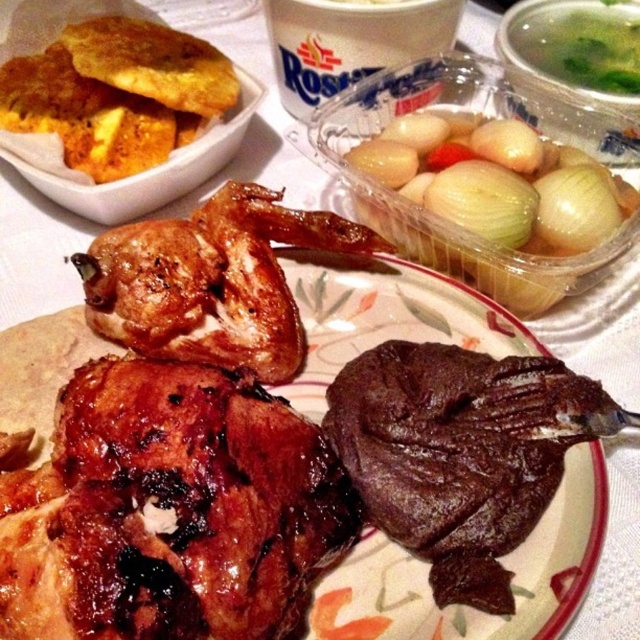
You are a food delivery person who needs to pick up the translucent plastic container at upper right and the green leafy vegetable at upper right from the table. Which object should you grab first to avoid knocking over the other?

You should grab the translucent plastic container at upper right first because it is in front of the green leafy vegetable at upper right, so moving it first would prevent disturbing the other object.

You are a food delivery person who needs to place a hot pad between the glossy brown chicken at center and the green leafy vegetable at upper right. The hot pad requires 40 inches of space. Can you fit it between them?

The distance between the glossy brown chicken at center and the green leafy vegetable at upper right is 39.02 inches, which is less than the required 40 inches. Therefore, the hot pad cannot be placed between them.